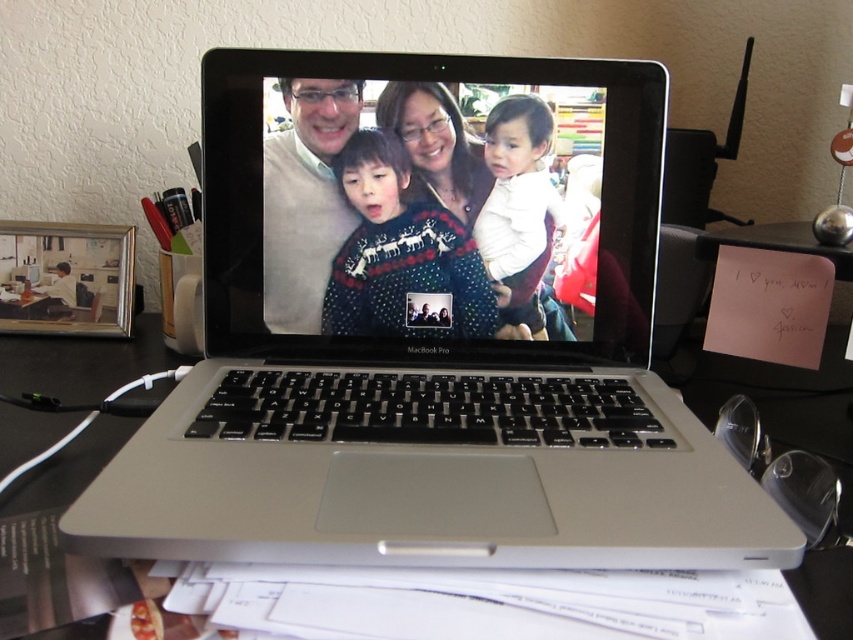
Measure the distance between knitted sweater at center and camera.

knitted sweater at center is 52.76 centimeters from camera.

Is knitted sweater at center further to camera compared to white soft fabric at center?

That is True.

Between point (367, 156) and point (514, 156), which one is positioned in front?

Point (514, 156) is in front.

You are a GUI agent. You are given a task and a screenshot of the screen. Output one action in this format:
    pyautogui.click(x=<x>, y=<y>)
    Task: Click on the knitted sweater at center
    
    Given the screenshot: What is the action you would take?
    pyautogui.click(x=401, y=253)

Between matte white sweater at center and white soft fabric at center, which one has less height?

white soft fabric at center is shorter.

Where is `matte white sweater at center`? matte white sweater at center is located at coordinates (305, 198).

Where is `matte white sweater at center`? Image resolution: width=853 pixels, height=640 pixels. matte white sweater at center is located at coordinates pyautogui.click(x=305, y=198).

Who is positioned more to the right, knitted sweater at center or matte white sweater at center?

knitted sweater at center is more to the right.

The height and width of the screenshot is (640, 853). What do you see at coordinates (401, 253) in the screenshot?
I see `knitted sweater at center` at bounding box center [401, 253].

You are a GUI agent. You are given a task and a screenshot of the screen. Output one action in this format:
    pyautogui.click(x=<x>, y=<y>)
    Task: Click on the knitted sweater at center
    The image size is (853, 640).
    Given the screenshot: What is the action you would take?
    pyautogui.click(x=401, y=253)